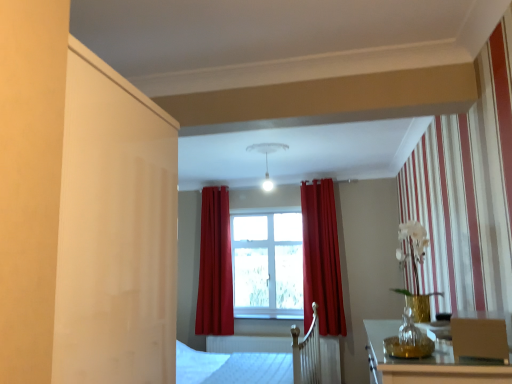
Question: Is matte red curtain at center, arranged as the second curtain when viewed from the right, shorter than transparent glass vase at lower right?

Choices:
 (A) no
 (B) yes

Answer: (A)

Question: Is matte red curtain at center, arranged as the second curtain when viewed from the right, beside transparent glass vase at lower right?

Choices:
 (A) yes
 (B) no

Answer: (B)

Question: Does matte red curtain at center, arranged as the first curtain when viewed from the left, have a lesser width compared to transparent glass vase at lower right?

Choices:
 (A) no
 (B) yes

Answer: (A)

Question: Considering the relative positions of matte red curtain at center, arranged as the second curtain when viewed from the right, and transparent glass vase at lower right in the image provided, is matte red curtain at center, arranged as the second curtain when viewed from the right, to the right of transparent glass vase at lower right from the viewer's perspective?

Choices:
 (A) yes
 (B) no

Answer: (B)

Question: Does matte red curtain at center, arranged as the second curtain when viewed from the right, lie behind transparent glass vase at lower right?

Choices:
 (A) yes
 (B) no

Answer: (A)

Question: Considering the relative sizes of matte red curtain at center, arranged as the second curtain when viewed from the right, and transparent glass vase at lower right in the image provided, is matte red curtain at center, arranged as the second curtain when viewed from the right, bigger than transparent glass vase at lower right?

Choices:
 (A) yes
 (B) no

Answer: (A)

Question: Considering the relative sizes of white matte light fixture at upper center and matte red curtain at center, which ranks as the 1th curtain in right-to-left order, in the image provided, is white matte light fixture at upper center shorter than matte red curtain at center, which ranks as the 1th curtain in right-to-left order,?

Choices:
 (A) yes
 (B) no

Answer: (A)

Question: From the image's perspective, is white matte light fixture at upper center under matte red curtain at center, which ranks as the 1th curtain in right-to-left order?

Choices:
 (A) yes
 (B) no

Answer: (B)

Question: Is white matte light fixture at upper center located outside matte red curtain at center, the second curtain from the left?

Choices:
 (A) no
 (B) yes

Answer: (B)

Question: From a real-world perspective, is white matte light fixture at upper center over matte red curtain at center, the second curtain from the left?

Choices:
 (A) yes
 (B) no

Answer: (A)

Question: Is white matte light fixture at upper center thinner than matte red curtain at center, which ranks as the 1th curtain in right-to-left order?

Choices:
 (A) no
 (B) yes

Answer: (A)

Question: Is white matte light fixture at upper center positioned far away from matte red curtain at center, which ranks as the 1th curtain in right-to-left order?

Choices:
 (A) no
 (B) yes

Answer: (B)

Question: Is matte brown armchair at lower right to the right of clear glass window at center from the viewer's perspective?

Choices:
 (A) yes
 (B) no

Answer: (A)